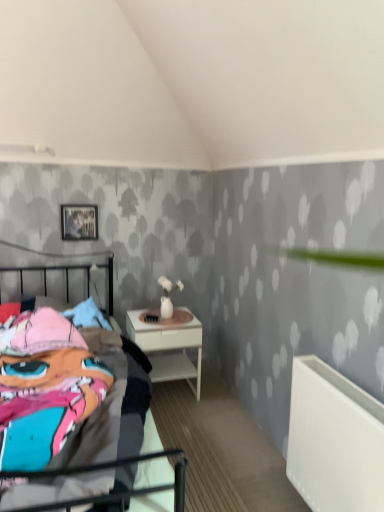
Question: Is white glossy nightstand at center looking in the opposite direction of multicolored fabric bed at left?

Choices:
 (A) no
 (B) yes

Answer: (A)

Question: Considering the relative positions of white glossy nightstand at center and multicolored fabric bed at left in the image provided, is white glossy nightstand at center to the left of multicolored fabric bed at left from the viewer's perspective?

Choices:
 (A) no
 (B) yes

Answer: (A)

Question: Is multicolored fabric bed at left surrounded by white glossy nightstand at center?

Choices:
 (A) yes
 (B) no

Answer: (B)

Question: Does white glossy nightstand at center have a lesser height compared to multicolored fabric bed at left?

Choices:
 (A) no
 (B) yes

Answer: (B)

Question: Does white glossy nightstand at center have a larger size compared to multicolored fabric bed at left?

Choices:
 (A) yes
 (B) no

Answer: (B)

Question: Is white glossy nightstand at center behind multicolored fabric bed at left?

Choices:
 (A) yes
 (B) no

Answer: (A)

Question: Considering the relative sizes of metallic silver picture frame at upper left and white plastic radiator at lower right in the image provided, is metallic silver picture frame at upper left bigger than white plastic radiator at lower right?

Choices:
 (A) yes
 (B) no

Answer: (B)

Question: Is metallic silver picture frame at upper left shorter than white plastic radiator at lower right?

Choices:
 (A) yes
 (B) no

Answer: (A)

Question: Is metallic silver picture frame at upper left next to white plastic radiator at lower right and touching it?

Choices:
 (A) yes
 (B) no

Answer: (B)

Question: Is metallic silver picture frame at upper left at the right side of white plastic radiator at lower right?

Choices:
 (A) yes
 (B) no

Answer: (B)

Question: Considering the relative sizes of metallic silver picture frame at upper left and white plastic radiator at lower right in the image provided, is metallic silver picture frame at upper left smaller than white plastic radiator at lower right?

Choices:
 (A) no
 (B) yes

Answer: (B)

Question: Is metallic silver picture frame at upper left to the left of white plastic radiator at lower right from the viewer's perspective?

Choices:
 (A) no
 (B) yes

Answer: (B)

Question: Is multicolored fabric bed at left closer to camera compared to white plastic radiator at lower right?

Choices:
 (A) yes
 (B) no

Answer: (A)